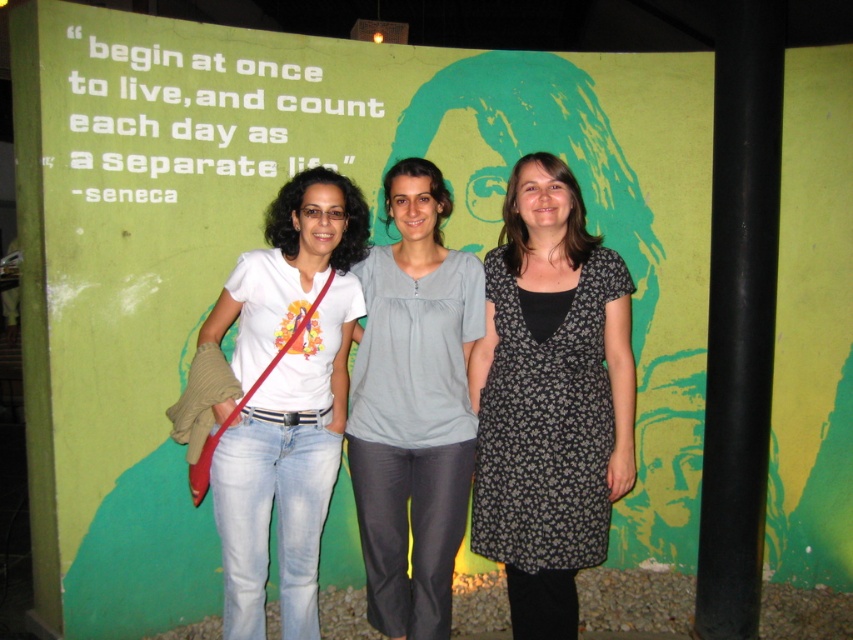
You are standing in front of the green wall with the Seneca quote. You notice two points marked on the wall at coordinates point (355, 381) and point (233, 566). If you were to walk towards the wall, which point would appear closer to you?

Point (233, 566) would appear closer to you because it is in front of point (355, 381).